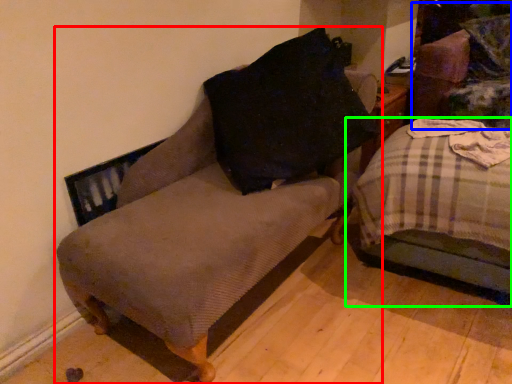
Question: Which object is positioned farthest from furniture (highlighted by a red box)? Select from swivel chair (highlighted by a blue box) and studio couch (highlighted by a green box).

Choices:
 (A) swivel chair
 (B) studio couch

Answer: (A)